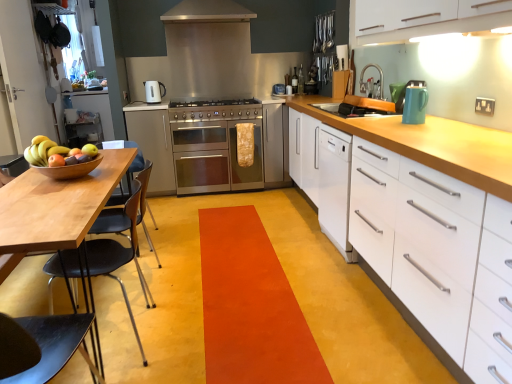
Question: Can stainless steel oven at center be found inside shiny wooden bowl at left?

Choices:
 (A) yes
 (B) no

Answer: (B)

Question: Does shiny wooden bowl at left have a greater width compared to stainless steel oven at center?

Choices:
 (A) yes
 (B) no

Answer: (B)

Question: From a real-world perspective, is shiny wooden bowl at left located beneath stainless steel oven at center?

Choices:
 (A) yes
 (B) no

Answer: (B)

Question: Is shiny wooden bowl at left far from stainless steel oven at center?

Choices:
 (A) no
 (B) yes

Answer: (B)

Question: Does shiny wooden bowl at left turn towards stainless steel oven at center?

Choices:
 (A) no
 (B) yes

Answer: (B)

Question: Is shiny wooden bowl at left thinner than stainless steel oven at center?

Choices:
 (A) no
 (B) yes

Answer: (B)

Question: From a real-world perspective, is white matte cabinet at right, positioned as the 3th cabinetry in back-to-front order, physically below teal glossy kettle at upper right, positioned as the first kitchen appliance in bottom-to-top order?

Choices:
 (A) no
 (B) yes

Answer: (B)

Question: Are white matte cabinet at right, the 3th cabinetry from the left, and teal glossy kettle at upper right, the 2th kitchen appliance positioned from the top, making contact?

Choices:
 (A) yes
 (B) no

Answer: (B)

Question: Is white matte cabinet at right, which ranks as the 1th cabinetry in front-to-back order, completely or partially outside of teal glossy kettle at upper right, the 1th kitchen appliance in the front-to-back sequence?

Choices:
 (A) no
 (B) yes

Answer: (B)

Question: Considering the relative sizes of white matte cabinet at right, which ranks as the 1th cabinetry in front-to-back order, and teal glossy kettle at upper right, the 2th kitchen appliance positioned from the top, in the image provided, is white matte cabinet at right, which ranks as the 1th cabinetry in front-to-back order, wider than teal glossy kettle at upper right, the 2th kitchen appliance positioned from the top,?

Choices:
 (A) yes
 (B) no

Answer: (A)

Question: Considering the relative positions of white matte cabinet at right, the 3th cabinetry from the left, and teal glossy kettle at upper right, positioned as the first kitchen appliance in bottom-to-top order, in the image provided, is white matte cabinet at right, the 3th cabinetry from the left, behind teal glossy kettle at upper right, positioned as the first kitchen appliance in bottom-to-top order,?

Choices:
 (A) yes
 (B) no

Answer: (B)

Question: Does white matte cabinet at right, which ranks as the 1th cabinetry in front-to-back order, have a lesser height compared to teal glossy kettle at upper right, the 1th kitchen appliance in the front-to-back sequence?

Choices:
 (A) yes
 (B) no

Answer: (B)

Question: Considering the relative sizes of white matte cabinet at right, the 3th cabinetry from the left, and stainless steel oven at center, placed as the second cabinetry when sorted from front to back, in the image provided, is white matte cabinet at right, the 3th cabinetry from the left, thinner than stainless steel oven at center, placed as the second cabinetry when sorted from front to back,?

Choices:
 (A) no
 (B) yes

Answer: (B)